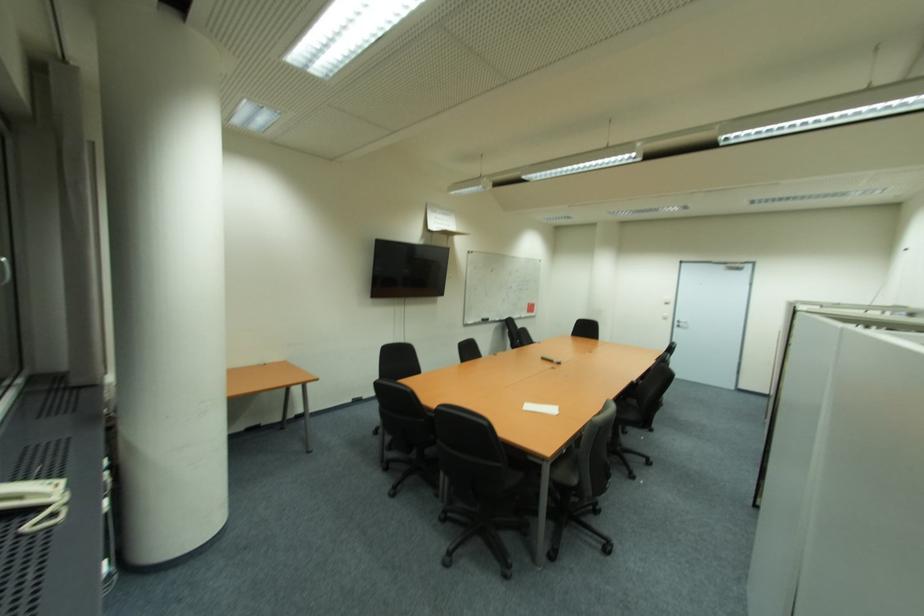
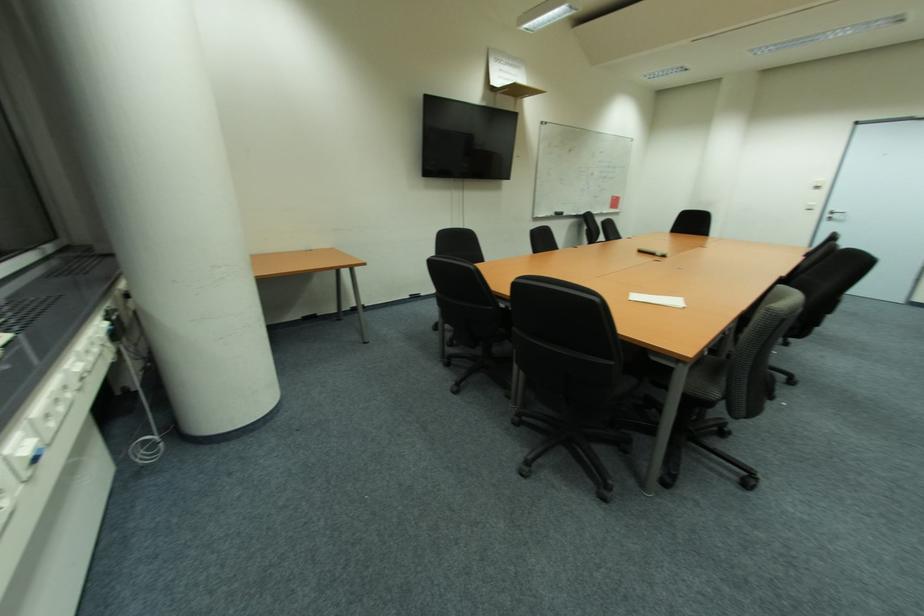
Find the pixel in the second image that matches (x=686, y=325) in the first image.

(842, 217)